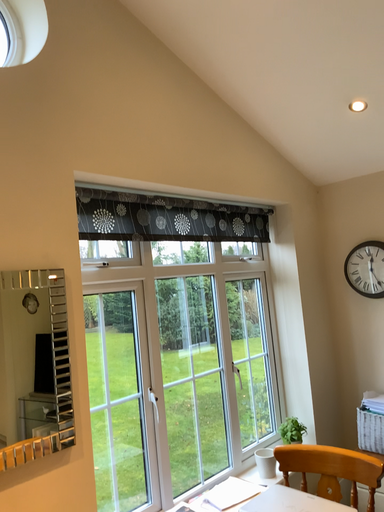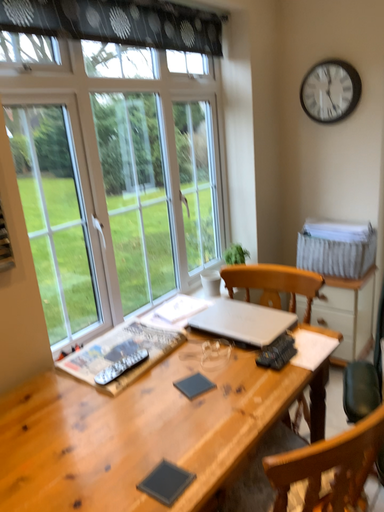
Question: How did the camera likely rotate when shooting the video?

Choices:
 (A) rotated right
 (B) rotated left

Answer: (A)